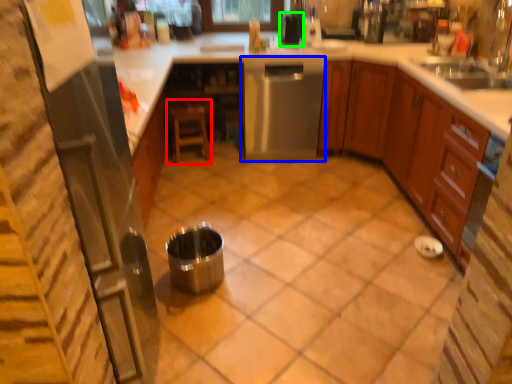
Question: Which is farther away from stool (highlighted by a red box)? home appliance (highlighted by a blue box) or appliance (highlighted by a green box)?

Choices:
 (A) home appliance
 (B) appliance

Answer: (B)